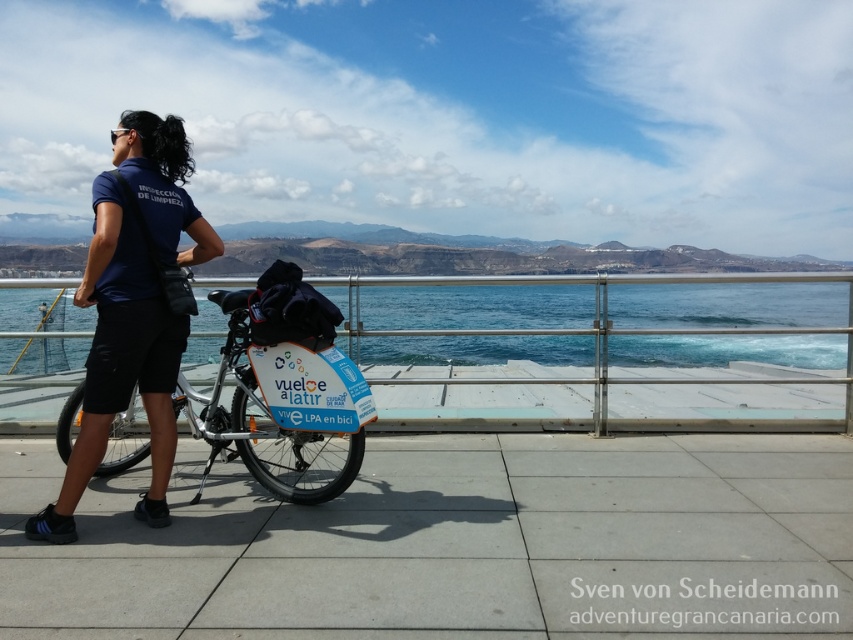
You are a tailor who needs to determine if the blue fabric shirt at center can be folded and placed inside the blue matte bicycle at center. Based on the scene description, can you confirm if the shirt will fit inside the bicycle?

The blue fabric shirt at center has a smaller width than the blue matte bicycle at center, so when folded, it should fit inside the blue matte bicycle at center.

You are a photographer positioned at the waterfront promenade. You need to capture a photo where the blue fabric shirt at center is clearly visible above the blue matte bicycle at center. Based on the scene description, is this possible?

Yes, the blue fabric shirt at center has a greater height compared to the blue matte bicycle at center, so it can be positioned to be visible above the bicycle in the photo.

You are planning to take a photo of the blue water at lower center and the blue matte bicycle at center. To ensure both are fully visible in the frame, which object should you position closer to the edge of the photo?

The blue water at lower center might be wider than the blue matte bicycle at center, so you should position the blue water at lower center closer to the edge of the photo to accommodate its greater width.